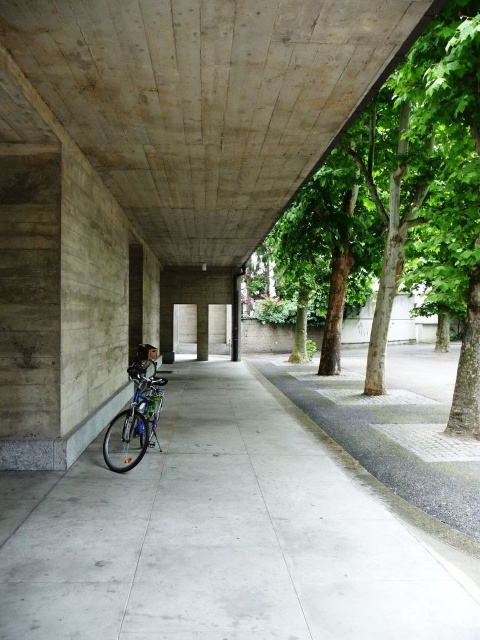
Question: Among these objects, which one is nearest to the camera?

Choices:
 (A) green leafy tree at center
 (B) shiny blue bicycle at center-left
 (C) concrete ceiling at upper center
 (D) gray concrete pavement at lower left

Answer: (C)

Question: Is gray concrete pavement at lower left wider than shiny blue bicycle at center-left?

Choices:
 (A) no
 (B) yes

Answer: (A)

Question: Which of the following is the closest to the observer?

Choices:
 (A) (448, 186)
 (B) (368, 3)
 (C) (145, 444)

Answer: (B)

Question: Is gray concrete pavement at lower left thinner than shiny blue bicycle at center-left?

Choices:
 (A) yes
 (B) no

Answer: (A)

Question: Which object is farther from the camera taking this photo?

Choices:
 (A) gray concrete pavement at lower left
 (B) green leafy tree at center
 (C) shiny blue bicycle at center-left
 (D) concrete ceiling at upper center

Answer: (B)

Question: Does concrete ceiling at upper center come in front of shiny blue bicycle at center-left?

Choices:
 (A) no
 (B) yes

Answer: (B)